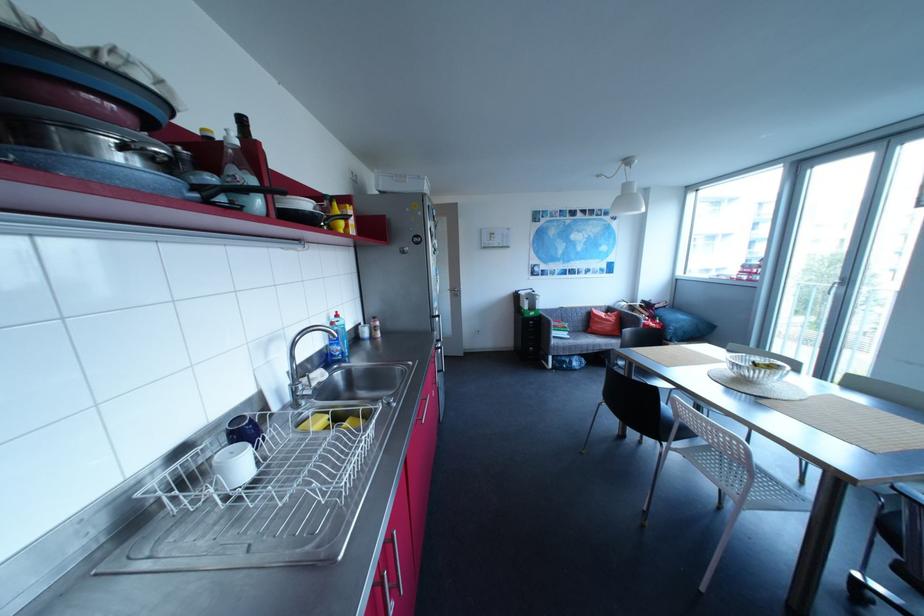
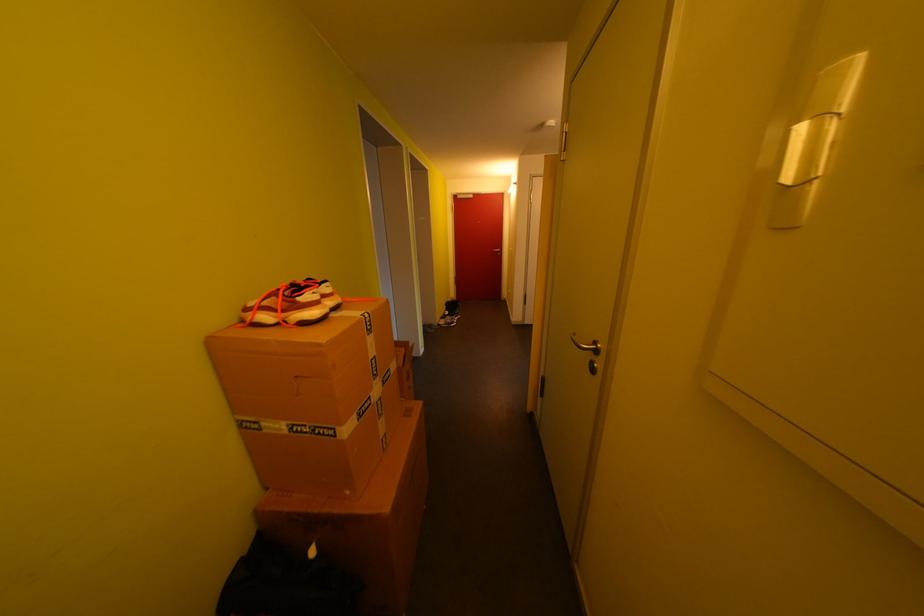
The images are taken continuously from a first-person perspective. In which direction are you moving?

The cameraman moved toward left, forward.